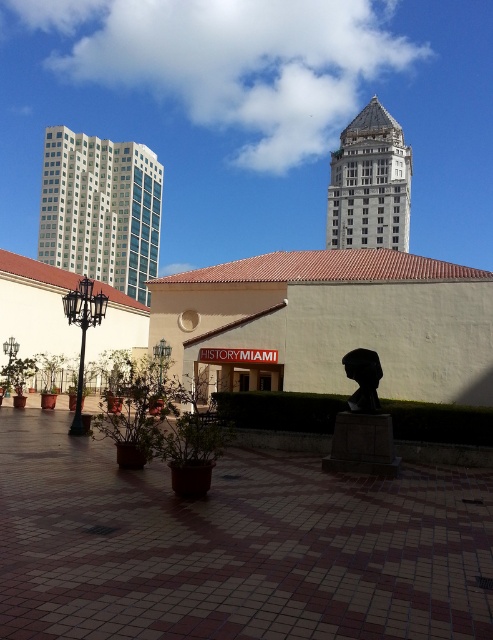
Between white glass building at upper left and gray stone tower at upper center, which one is positioned higher?

gray stone tower at upper center is higher up.

Is white glass building at upper left positioned at the back of gray stone tower at upper center?

Yes.

I want to click on white glass building at upper left, so pyautogui.click(x=101, y=209).

Does white glass building at upper left have a greater height compared to black matte bust at center?

Indeed, white glass building at upper left has a greater height compared to black matte bust at center.

The height and width of the screenshot is (640, 493). I want to click on white glass building at upper left, so click(101, 209).

Can you confirm if gray stone tower at upper center is positioned to the left of black matte bust at center?

Incorrect, gray stone tower at upper center is not on the left side of black matte bust at center.

Is gray stone tower at upper center below black matte bust at center?

Actually, gray stone tower at upper center is above black matte bust at center.

Between point (376, 221) and point (362, 406), which one is positioned behind?

The point (376, 221) is more distant.

Find the location of a particular element. gray stone tower at upper center is located at coordinates (370, 182).